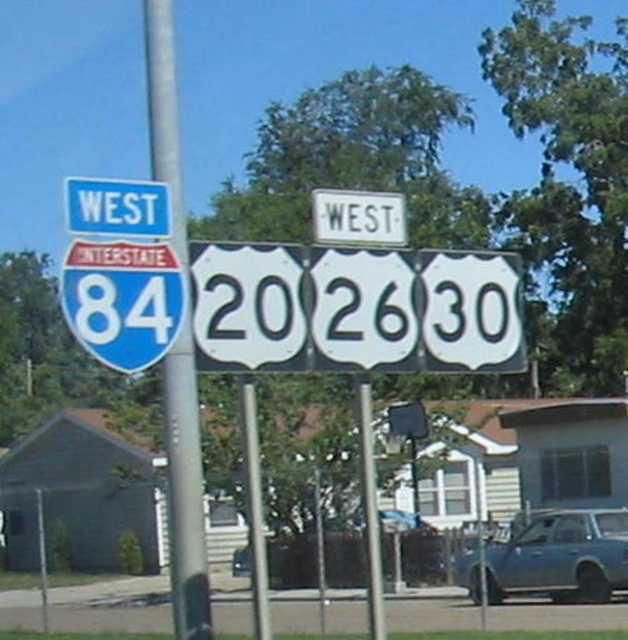
Between point (180, 454) and point (553, 596), which one is positioned behind?

Point (553, 596)

Is point (170, 500) closer to camera compared to point (533, 556)?

Yes, it is in front of point (533, 556).

Image resolution: width=628 pixels, height=640 pixels. Find the location of `metallic gray pole at left`. metallic gray pole at left is located at coordinates (176, 346).

Is point (192, 328) positioned behind point (384, 212)?

No, it is in front of (384, 212).

Does metallic gray pole at left appear on the right side of white plastic sign at upper center?

No, metallic gray pole at left is not to the right of white plastic sign at upper center.

Who is more forward, (168,125) or (354,230)?

Point (168,125) is in front.

The image size is (628, 640). Identify the location of metallic gray pole at left. (176, 346).

The height and width of the screenshot is (640, 628). I want to click on white plastic road sign at center, so click(354, 308).

Who is taller, white plastic road sign at center or white plastic sign at upper center?

white plastic road sign at center is taller.

What are the coordinates of `white plastic road sign at center` in the screenshot? It's located at (354, 308).